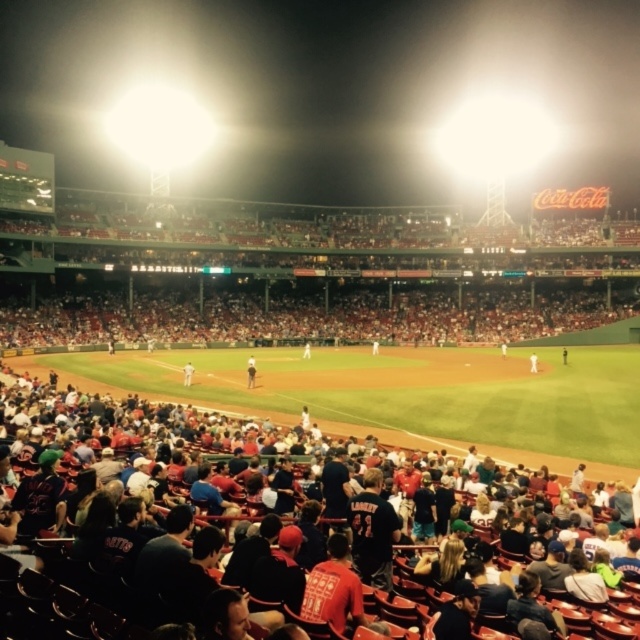
Is light brown leather baseball glove at center wider than white uniformed player at center?

Yes.

Is the position of light brown leather baseball glove at center less distant than that of white uniformed player at center?

Yes, it is.

Is point (252, 372) positioned in front of point (186, 365)?

Yes, it is in front of point (186, 365).

Identify the location of light brown leather baseball glove at center. The width and height of the screenshot is (640, 640). (250, 371).

Describe the element at coordinates (188, 372) in the screenshot. I see `white uniformed player at center` at that location.

Is the position of white uniformed player at center more distant than that of white uniform at center?

No, it is not.

Describe the element at coordinates (188, 372) in the screenshot. This screenshot has height=640, width=640. I see `white uniformed player at center` at that location.

At what (x,y) coordinates should I click in order to perform the action: click on white uniformed player at center. Please return your answer as a coordinate pair (x, y). Looking at the image, I should click on (188, 372).

Is light brown leather baseball glove at center to the left of white uniform at center from the viewer's perspective?

Correct, you'll find light brown leather baseball glove at center to the left of white uniform at center.

Is light brown leather baseball glove at center above white uniform at center?

Indeed, light brown leather baseball glove at center is positioned over white uniform at center.

This screenshot has height=640, width=640. What do you see at coordinates (250, 371) in the screenshot?
I see `light brown leather baseball glove at center` at bounding box center [250, 371].

You are a GUI agent. You are given a task and a screenshot of the screen. Output one action in this format:
    pyautogui.click(x=<x>, y=<y>)
    Task: Click on the light brown leather baseball glove at center
    The width and height of the screenshot is (640, 640).
    Given the screenshot: What is the action you would take?
    pyautogui.click(x=250, y=371)